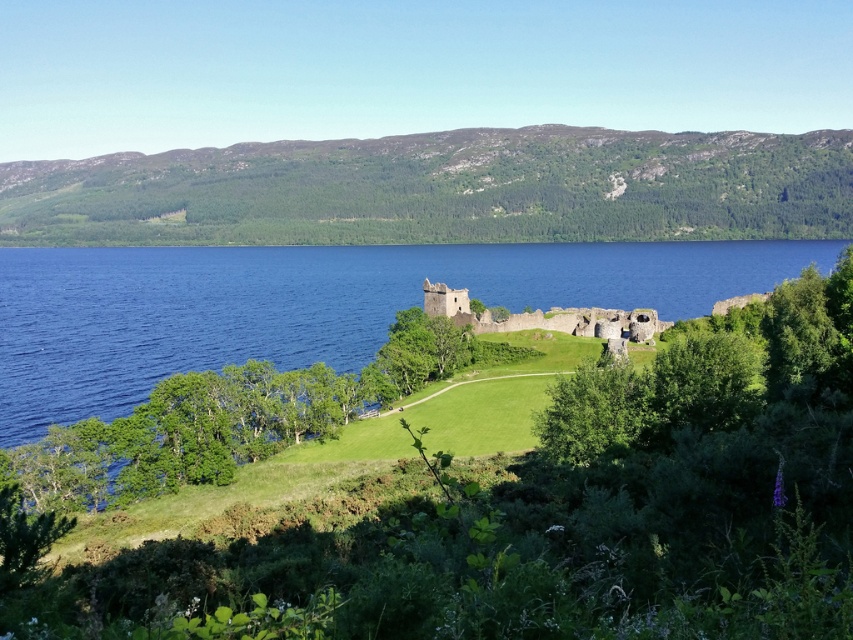
Question: Where is green grassy hillside at upper center located in relation to green leafy tree at center in the image?

Choices:
 (A) left
 (B) right

Answer: (A)

Question: Based on their relative distances, which object is farther from the green leafy tree at center?

Choices:
 (A) blue water at center
 (B) stone ruins at center
 (C) green grassy hillside at upper center

Answer: (C)

Question: Can you confirm if blue water at center is wider than green leafy tree at center?

Choices:
 (A) no
 (B) yes

Answer: (B)

Question: Estimate the real-world distances between objects in this image. Which object is farther from the stone ruins at center?

Choices:
 (A) green grassy hillside at upper center
 (B) blue water at center
 (C) green leafy tree at center

Answer: (A)

Question: Does green grassy hillside at upper center have a greater width compared to stone ruins at center?

Choices:
 (A) yes
 (B) no

Answer: (A)

Question: Which point appears closest to the camera in this image?

Choices:
 (A) (476, 326)
 (B) (27, 241)

Answer: (A)